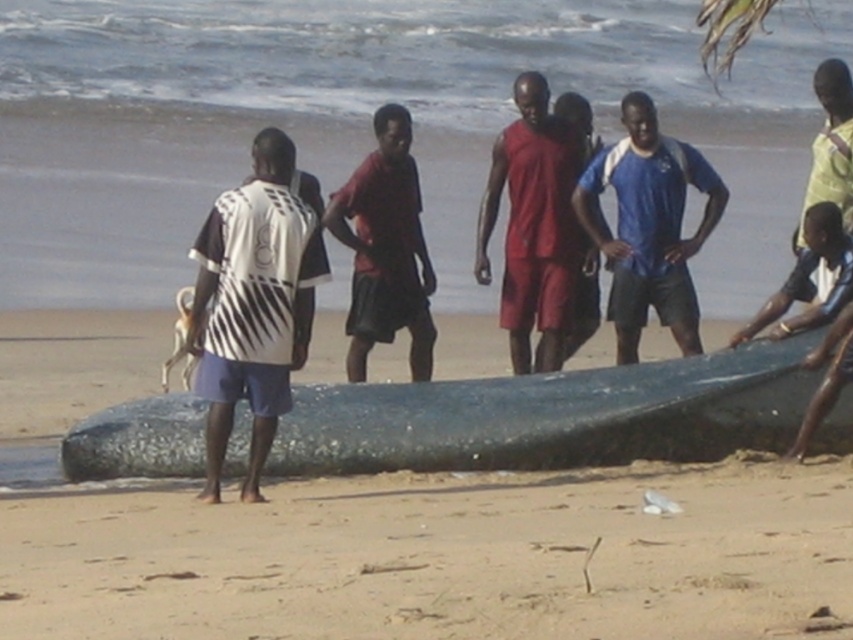
Question: In this image, where is sandy beach at lower center located relative to blue jersey at center?

Choices:
 (A) right
 (B) left

Answer: (B)

Question: Which point appears farthest from the camera in this image?

Choices:
 (A) (538, 435)
 (B) (552, 362)

Answer: (B)

Question: Is matte red tank top at center below blue jersey at center?

Choices:
 (A) no
 (B) yes

Answer: (B)

Question: Which point appears closest to the camera in this image?

Choices:
 (A) (375, 134)
 (B) (309, 209)
 (C) (688, 307)
 (D) (430, 499)

Answer: (B)

Question: Where is matte red tank top at center located in relation to blue jersey at center in the image?

Choices:
 (A) right
 (B) left

Answer: (B)

Question: Estimate the real-world distances between objects in this image. Which object is closer to the shiny dark blue boat at center?

Choices:
 (A) white striped shirt at center
 (B) sandy beach at lower center
 (C) blue jersey at center

Answer: (A)